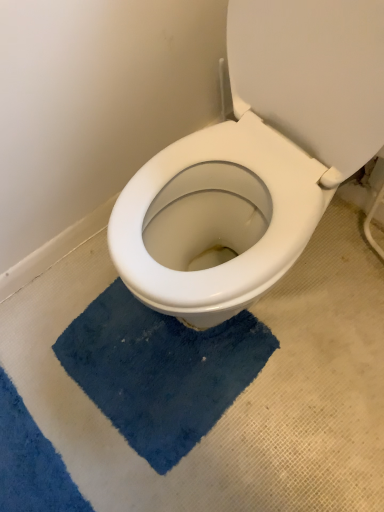
Identify the location of vacant space to the right of blue plush bath mat at center. Image resolution: width=384 pixels, height=512 pixels. (321, 365).